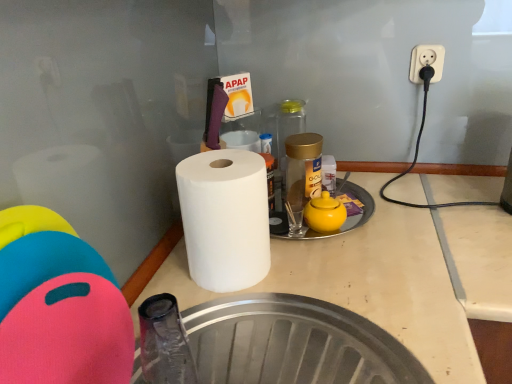
Question: From the image's perspective, is gold metallic jar at center, which appears as the second bottle when viewed from the back, located above or below rubberized plastic cutting board at left?

Choices:
 (A) above
 (B) below

Answer: (A)

Question: Visually, is gold metallic jar at center, which appears as the second bottle when viewed from the back, positioned to the left or to the right of rubberized plastic cutting board at left?

Choices:
 (A) right
 (B) left

Answer: (A)

Question: Estimate the real-world distances between objects in this image. Which object is farther from the rubberized plastic cutting board at left?

Choices:
 (A) gold metallic jar at center, the 1th bottle positioned from the front
 (B) transparent glass bottle at center, the 1th bottle from the back
 (C) white matte paper towel at center
 (D) yellow matte teapot at center
 (E) white plastic outlet at upper right

Answer: (E)

Question: Which object is the farthest from the yellow matte teapot at center?

Choices:
 (A) white matte paper towel at center
 (B) white plastic outlet at upper right
 (C) rubberized plastic cutting board at left
 (D) transparent glass bottle at center, the 1th bottle from the back
 (E) gold metallic jar at center, the 1th bottle positioned from the front

Answer: (C)